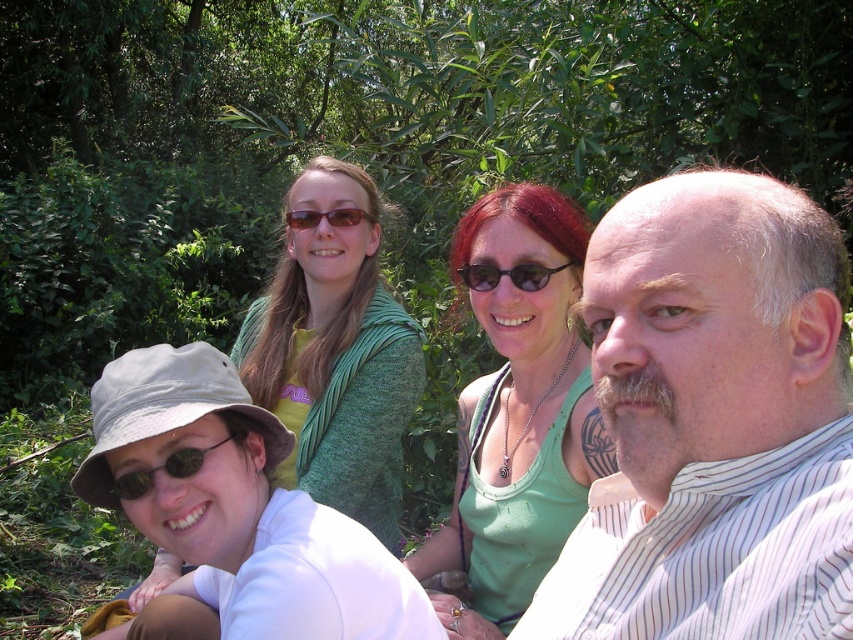
Is green knitted sweater at upper center closer to camera compared to black plastic sunglasses at center?

Yes.

Is point (328, 417) in front of point (463, 273)?

No.

What do you see at coordinates (335, 355) in the screenshot? I see `green knitted sweater at upper center` at bounding box center [335, 355].

The height and width of the screenshot is (640, 853). Find the location of `green knitted sweater at upper center`. green knitted sweater at upper center is located at coordinates (335, 355).

Does green knitted sweater at upper center come in front of brown matte sunglasses at upper center?

Yes, it is.

Does green knitted sweater at upper center appear under brown matte sunglasses at upper center?

Indeed, green knitted sweater at upper center is positioned under brown matte sunglasses at upper center.

This screenshot has width=853, height=640. Describe the element at coordinates (335, 355) in the screenshot. I see `green knitted sweater at upper center` at that location.

At what (x,y) coordinates should I click in order to perform the action: click on green knitted sweater at upper center. Please return your answer as a coordinate pair (x, y). The width and height of the screenshot is (853, 640). Looking at the image, I should click on (335, 355).

Can you confirm if white striped shirt at center is taller than brown matte sunglasses at upper center?

A: Correct, white striped shirt at center is much taller as brown matte sunglasses at upper center.

Is point (770, 392) more distant than point (306, 212)?

No.

Between point (753, 387) and point (302, 216), which one is positioned in front?

Point (753, 387)

I want to click on white striped shirt at center, so click(712, 422).